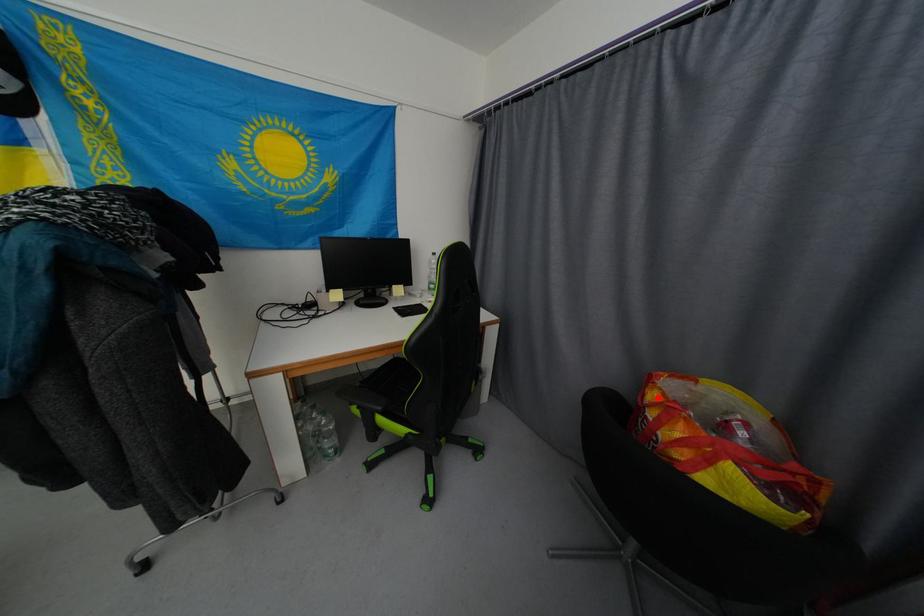
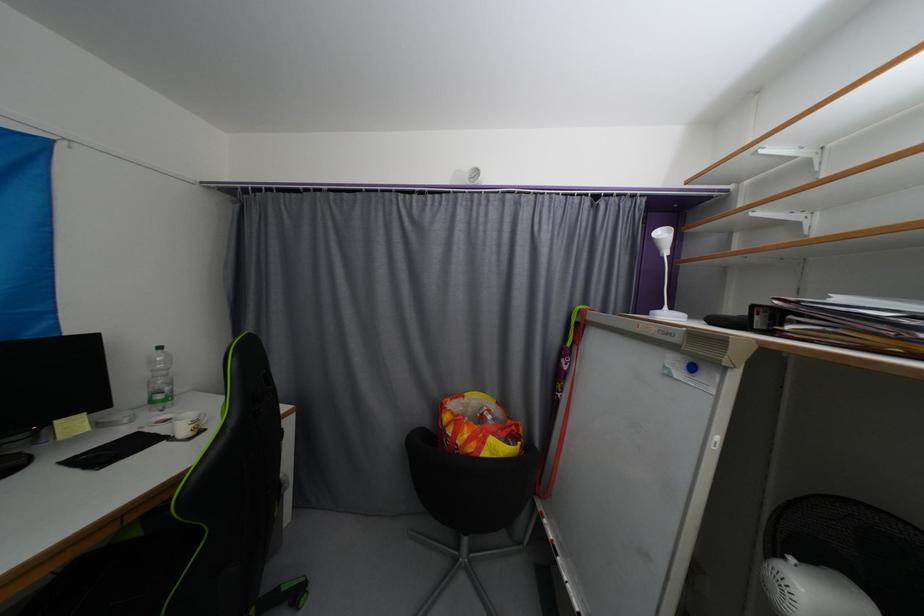
Find the pixel in the second image that matches the highlighted location in the first image.

(452, 419)